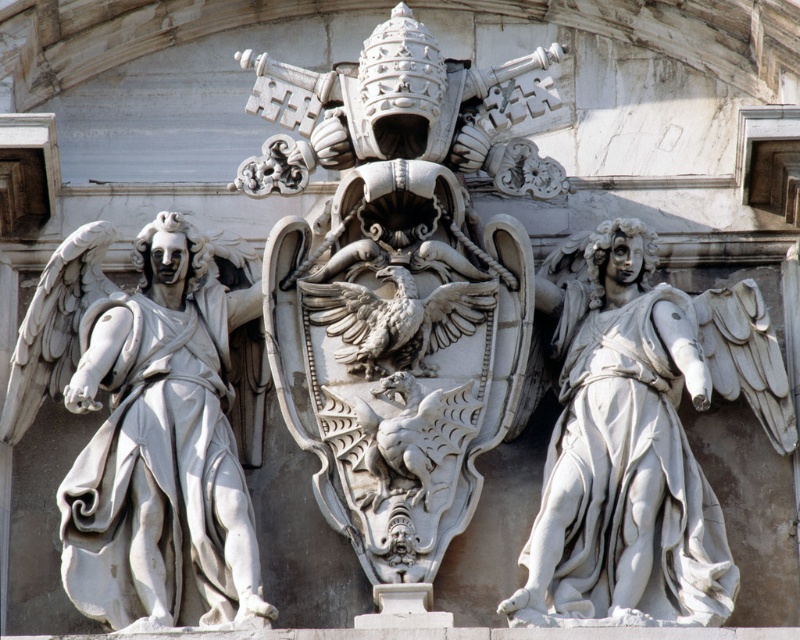
Is white marble angel at left further to camera compared to white marble angel at right?

Yes.

Does point (210, 561) lie in front of point (576, 397)?

Yes, it is.

This screenshot has height=640, width=800. In order to click on white marble angel at left in this screenshot , I will do tap(145, 426).

Which of these two, white marble coat of arms at center or white marble angel at right, stands shorter?

white marble angel at right

Is white marble coat of arms at center wider than white marble angel at right?

Correct, the width of white marble coat of arms at center exceeds that of white marble angel at right.

Does point (350, 397) come behind point (733, 321)?

No, it is not.

At what (x,y) coordinates should I click in order to perform the action: click on white marble coat of arms at center. Please return your answer as a coordinate pair (x, y). The width and height of the screenshot is (800, 640). Looking at the image, I should click on 397,282.

Between white marble coat of arms at center and white marble angel at left, which one appears on the right side from the viewer's perspective?

From the viewer's perspective, white marble coat of arms at center appears more on the right side.

Does white marble coat of arms at center have a larger size compared to white marble angel at left?

Indeed, white marble coat of arms at center has a larger size compared to white marble angel at left.

Is point (282, 337) farther from camera compared to point (204, 358)?

Yes, point (282, 337) is farther from viewer.

You are a GUI agent. You are given a task and a screenshot of the screen. Output one action in this format:
    pyautogui.click(x=<x>, y=<y>)
    Task: Click on the white marble coat of arms at center
    
    Given the screenshot: What is the action you would take?
    pyautogui.click(x=397, y=282)